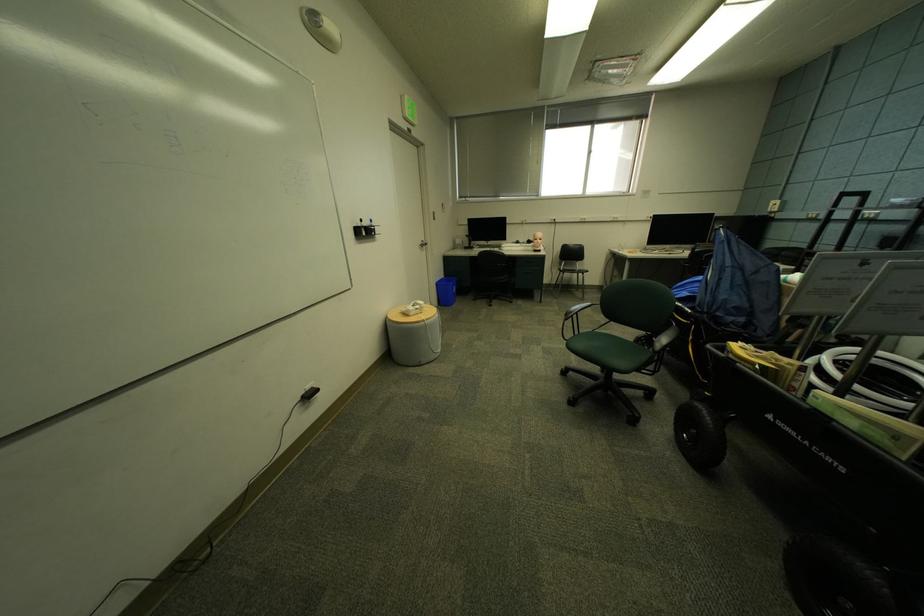
The image size is (924, 616). What do you see at coordinates (421, 244) in the screenshot?
I see `the silver door handle` at bounding box center [421, 244].